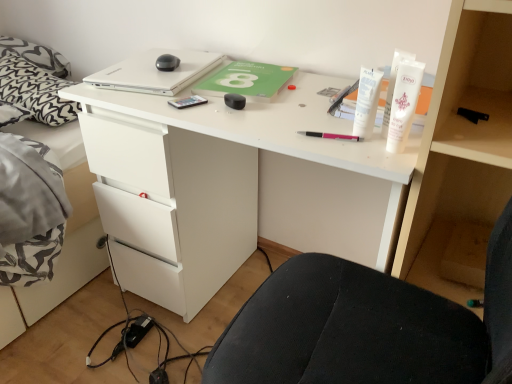
Find the location of a particular element. The width and height of the screenshot is (512, 384). vacant space in front of pink plastic pen at center, acting as the 3th stationery starting from the back is located at coordinates (349, 154).